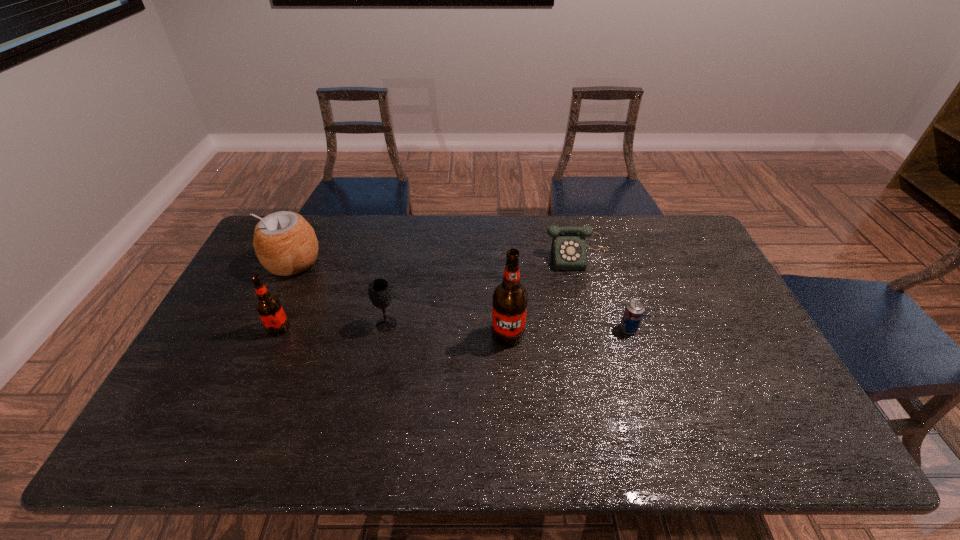
I want to click on vacant space located on the dial of the telephone, so click(586, 288).

Find the location of a particular element. This screenshot has width=960, height=540. free point located 0.340m on the left of the wineglass is located at coordinates (257, 324).

Find the location of a particular element. This screenshot has height=540, width=960. vacant space situated 0.320m on the right of the coconut is located at coordinates (419, 262).

Locate an element on the screen. free location located 0.230m on the front of the beer can is located at coordinates (654, 409).

Identify the location of telephone located at the far edge. The width and height of the screenshot is (960, 540). (568, 250).

Where is `coconut at the far edge`? Image resolution: width=960 pixels, height=540 pixels. coconut at the far edge is located at coordinates (285, 243).

This screenshot has width=960, height=540. I want to click on object that is positioned at the left edge, so click(285, 243).

Where is `object that is at the far left corner`? object that is at the far left corner is located at coordinates (285, 243).

Identify the location of vacant area at the far edge of the desktop. (318, 239).

At what (x,y) coordinates should I click in order to perform the action: click on vacant space at the near edge of the desktop. Please return your answer as a coordinate pair (x, y). The width and height of the screenshot is (960, 540). Looking at the image, I should click on (456, 407).